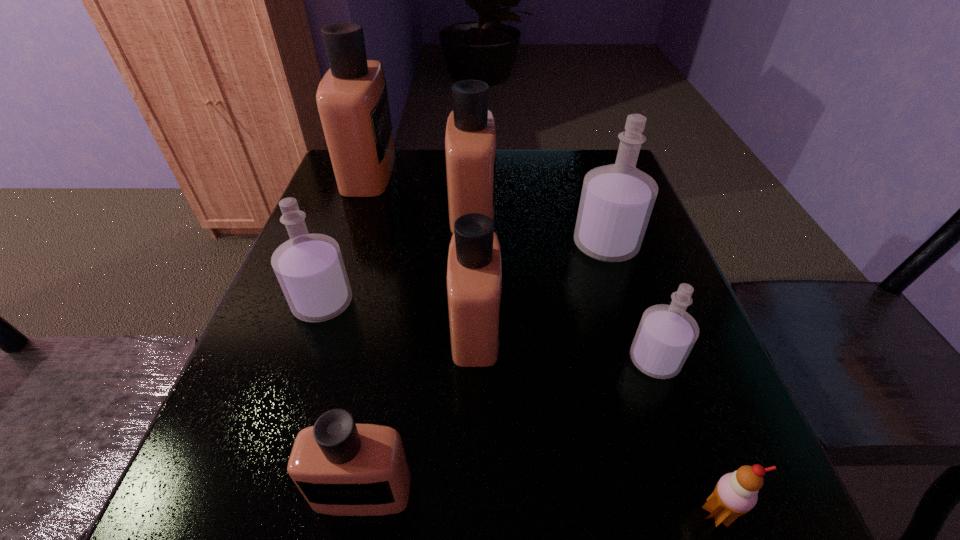
At what (x,y) coordinates should I click in order to perform the action: click on free area in between the second biggest beige perfume and the leftmost purple perfume. Please return your answer as a coordinate pair (x, y). This screenshot has width=960, height=540. Looking at the image, I should click on (397, 256).

I want to click on vacant space that's between the second biggest beige perfume and the nearest perfume, so click(x=418, y=350).

Identify the location of vacant space that's between the tallest object and the second biggest beige perfume. (420, 190).

The width and height of the screenshot is (960, 540). What are the coordinates of `unoccupied area between the third biggest beige perfume and the biggest beige perfume` in the screenshot? It's located at (422, 250).

This screenshot has height=540, width=960. Identify the location of object that ranks as the second closest to the second smallest beige perfume. (470, 141).

Image resolution: width=960 pixels, height=540 pixels. I want to click on the second closest object to the biggest purple perfume, so click(474, 271).

Identify the location of perfume that stands as the fourth closest to the biggest purple perfume. The width and height of the screenshot is (960, 540). (309, 267).

Identify which perfume is the third closest to the tallest perfume. Please provide its 2D coordinates. Your answer should be formatted as a tuple, i.e. [(x, y)], where the tuple contains the x and y coordinates of a point satisfying the conditions above.

[(474, 271)]

Find the location of a particular element. beige perfume that stands as the closest to the nearest purple perfume is located at coordinates (474, 271).

Image resolution: width=960 pixels, height=540 pixels. In order to click on beige perfume that is the third closest to the smallest purple perfume in this screenshot , I will do `click(341, 468)`.